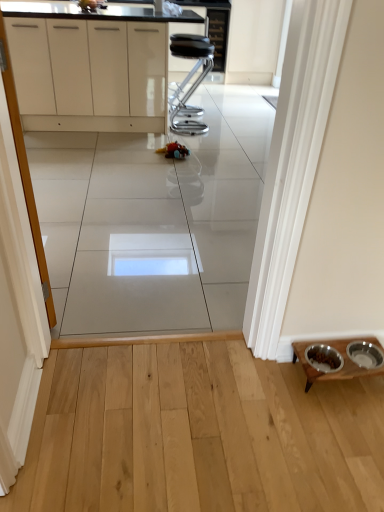
Question: From a real-world perspective, is white glossy cabinets at upper center above or below black leather stool at center?

Choices:
 (A) above
 (B) below

Answer: (A)

Question: Considering the positions of white glossy cabinets at upper center and black leather stool at center in the image, is white glossy cabinets at upper center taller or shorter than black leather stool at center?

Choices:
 (A) short
 (B) tall

Answer: (B)

Question: Estimate the real-world distances between objects in this image. Which object is farther from the white glossy cabinets at upper center?

Choices:
 (A) plush multicolored toy at center
 (B) white glossy cabinet at left
 (C) wooden table at lower right
 (D) black leather stool at center

Answer: (C)

Question: Based on their relative distances, which object is farther from the black leather stool at center?

Choices:
 (A) white glossy cabinets at upper center
 (B) white glossy cabinet at left
 (C) plush multicolored toy at center
 (D) wooden table at lower right

Answer: (D)